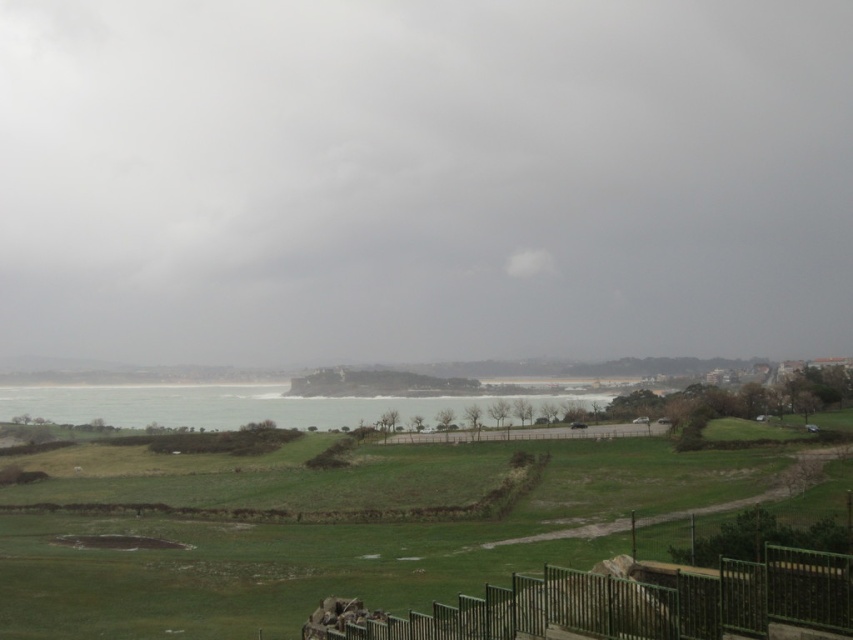
Image resolution: width=853 pixels, height=640 pixels. I want to click on gray cloudy sky at upper center, so click(x=424, y=179).

Is point (683, 540) positioned in front of point (844, 580)?

No.

Between point (335, 483) and point (637, 592), which one is positioned in front?

Point (637, 592)

Does point (282, 451) lie in front of point (350, 628)?

No, it is not.

This screenshot has width=853, height=640. Find the location of `green grassy field at lower center`. green grassy field at lower center is located at coordinates (340, 536).

Who is taller, green metal fence at lower center or green water at center?

With more height is green water at center.

Does point (518, 580) come in front of point (160, 385)?

Yes.

Which is behind, point (432, 611) or point (3, 413)?

Positioned behind is point (3, 413).

Identify the location of green metal fence at lower center. coord(637,604).